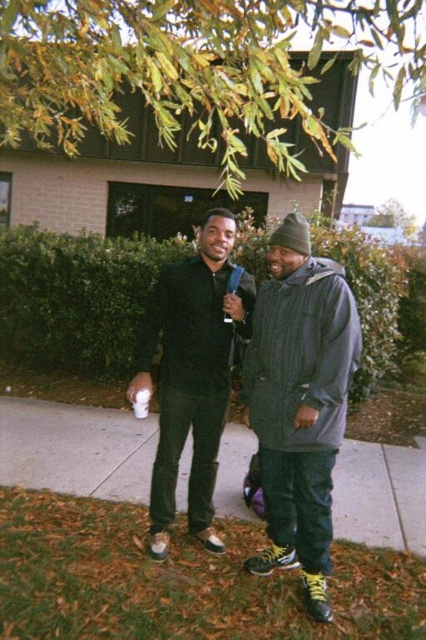
You are a photographer standing at the edge of the sidewalk. You want to take a photo of the matte black shirt at center and the green leafy tree at upper center. If your camera can focus on objects within 2 meters, will both subjects be in focus?

The green leafy tree at upper center is 1.78 meters away from matte black shirt at center. Since the camera can focus within 2 meters, both subjects are within the focus range and will be in focus.

You are a photographer trying to capture a photo of the green leafy tree at upper center and the matte black pants at lower center. Which object appears wider in the frame?

The matte black pants at lower center appears wider than the green leafy tree at upper center because the tree is narrower in width compared to the pants.

You are looking at the image of two people on a sidewalk surrounded by autumn trees. There is a point marked at coordinates (193, 68). What does this point indicate?

The point at coordinates (193, 68) indicates a green leafy tree at upper center in the image.